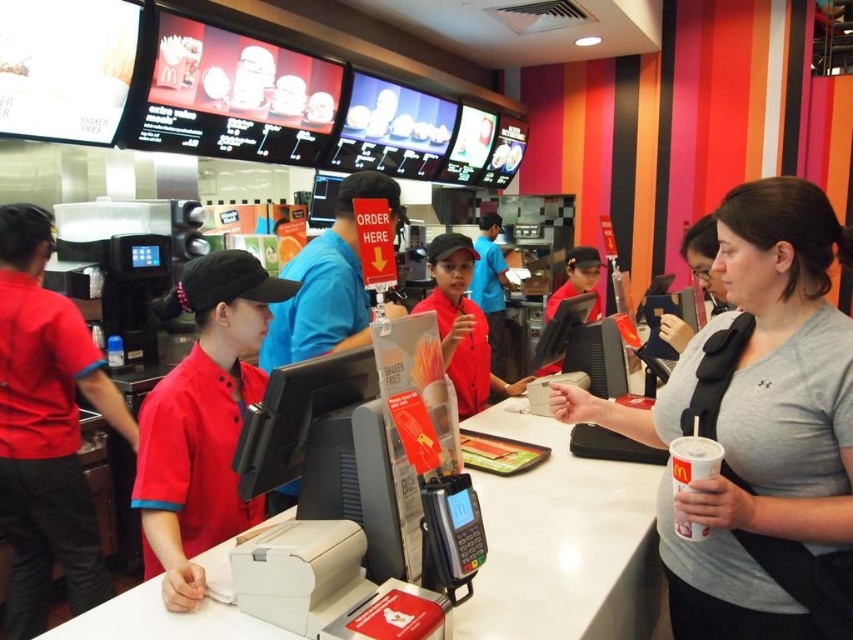
What are the coordinates of the gray matte shirt at center?

The gray matte shirt at center is located at point [759,429].

You are a customer in McDonalds and you want to hand over your payment to the employee. You are holding a gray matte shirt at center and a white paper cup at lower right. Which item should you hand over first to the employee?

The gray matte shirt at center is located above the white paper cup at lower right, so you should hand over the gray matte shirt at center first since it is closer to the employee.

You are a customer at McDonalds and you want to hand your payment to the employee behind the counter. You have a gray matte shirt at center and a white paper cup at lower right in your hands. Which object should you place closer to the counter to ensure the employee can easily reach it?

The white paper cup at lower right should be placed closer to the counter since the gray matte shirt at center is to the right of it, meaning the cup is nearer to the counter area.